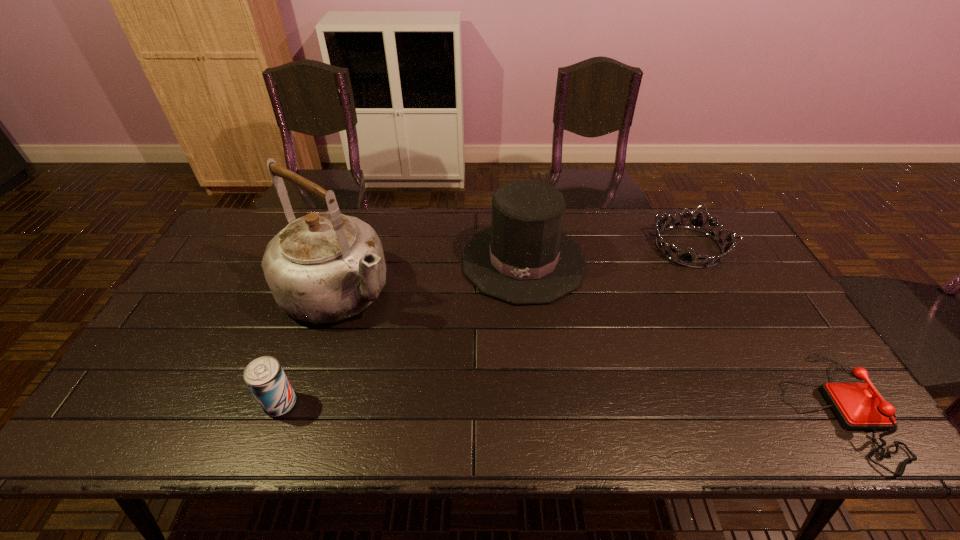
At what (x,y) coordinates should I click in order to perform the action: click on beer can. Please return your answer as a coordinate pair (x, y). The height and width of the screenshot is (540, 960). Looking at the image, I should click on (264, 376).

This screenshot has height=540, width=960. Identify the location of telephone. (857, 405).

Locate an element on the screen. tiara is located at coordinates (685, 259).

At what (x,y) coordinates should I click in order to perform the action: click on the tallest object. Please return your answer as a coordinate pair (x, y). Looking at the image, I should click on (324, 267).

Find the location of `the third object from left to right`. the third object from left to right is located at coordinates (524, 258).

At what (x,y) coordinates should I click in order to perform the action: click on the fourth shortest object. Please return your answer as a coordinate pair (x, y). The height and width of the screenshot is (540, 960). Looking at the image, I should click on (524, 258).

The width and height of the screenshot is (960, 540). Find the location of `vacant space positioned on the right of the third tallest object`. vacant space positioned on the right of the third tallest object is located at coordinates (433, 404).

At what (x,y) coordinates should I click in order to perform the action: click on free space located on the front-facing side of the tiara. Please return your answer as a coordinate pair (x, y). The width and height of the screenshot is (960, 540). Looking at the image, I should click on (664, 326).

Identify the location of vacant space located on the front-facing side of the tiara. (672, 300).

Find the location of a particular element. free space located 0.400m on the front-facing side of the tiara is located at coordinates (653, 363).